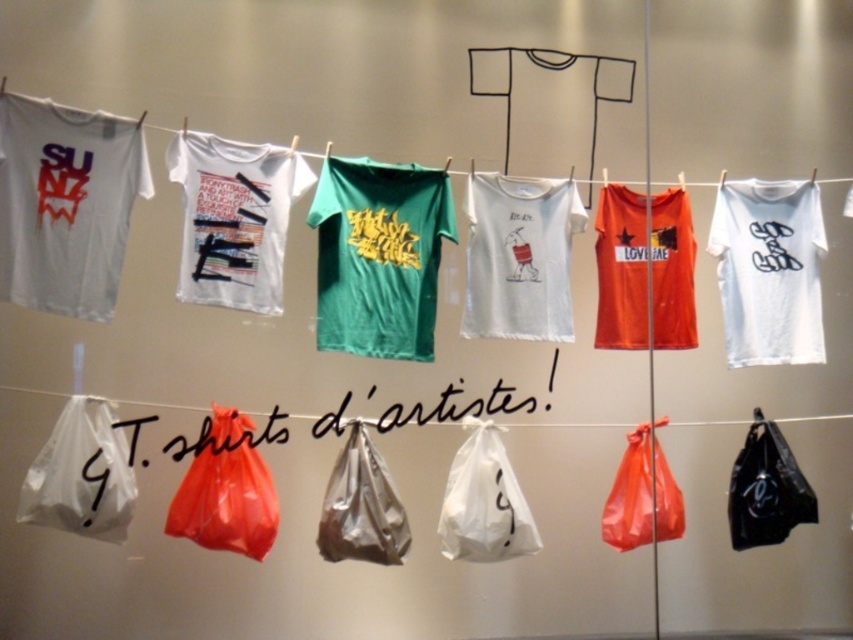
Is the position of white matte t-shirt at left more distant than that of white cotton t-shirts at upper center?

No, white matte t-shirt at left is in front of white cotton t-shirts at upper center.

Can you confirm if white matte t-shirt at left is bigger than white cotton t-shirts at upper center?

Incorrect, white matte t-shirt at left is not larger than white cotton t-shirts at upper center.

Measure the distance between point (4, 104) and camera.

The distance of point (4, 104) from camera is 8.31 feet.

Locate an element on the screen. The height and width of the screenshot is (640, 853). white matte t-shirt at left is located at coordinates (65, 204).

Does white plastic bag at lower left have a lesser width compared to white cotton t-shirts at upper center?

Indeed, white plastic bag at lower left has a lesser width compared to white cotton t-shirts at upper center.

Can you confirm if white plastic bag at lower left is taller than white cotton t-shirts at upper center?

Yes.

Image resolution: width=853 pixels, height=640 pixels. What do you see at coordinates (80, 474) in the screenshot? I see `white plastic bag at lower left` at bounding box center [80, 474].

The image size is (853, 640). I want to click on white plastic bag at lower left, so click(80, 474).

Who is positioned more to the right, white plastic bag at center or white cotton t-shirts at upper center?

white plastic bag at center

Between point (505, 476) and point (108, 122), which one is positioned behind?

The point (505, 476) is behind.

The width and height of the screenshot is (853, 640). Find the location of `white plastic bag at center`. white plastic bag at center is located at coordinates (485, 500).